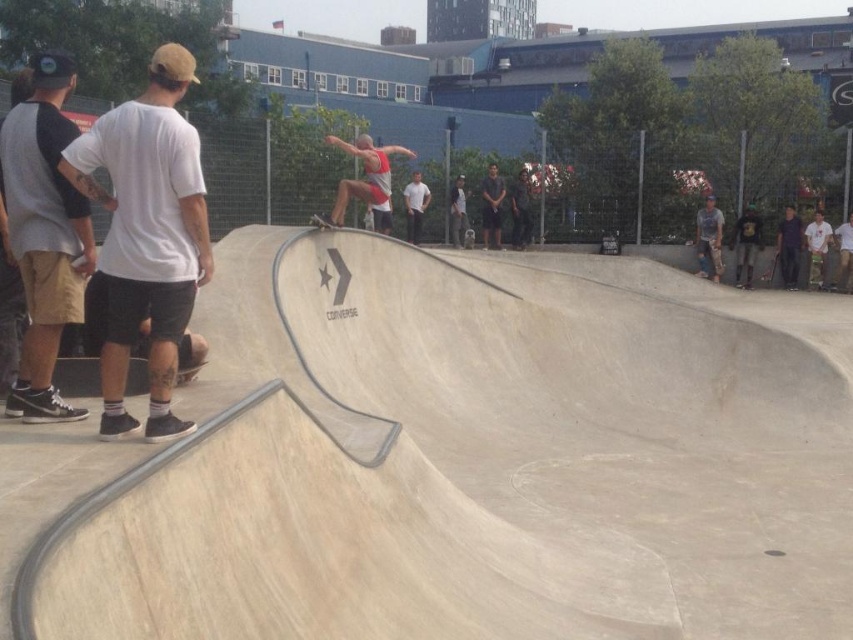
Which of these two, black matte skateboard at lower left or wooden skateboard at lower right, stands shorter?

black matte skateboard at lower left

Which of these two, black matte skateboard at lower left or wooden skateboard at lower right, stands taller?

With more height is wooden skateboard at lower right.

Between point (80, 387) and point (809, 285), which one is positioned behind?

The point (809, 285) is behind.

At what (x,y) coordinates should I click in order to perform the action: click on black matte skateboard at lower left. Please return your answer as a coordinate pair (x, y). The height and width of the screenshot is (640, 853). Looking at the image, I should click on (77, 376).

Which is more to the left, dark gray jeans at right or white matte skateboard at right?

dark gray jeans at right is more to the left.

Is point (734, 262) farther from viewer compared to point (819, 227)?

Yes, point (734, 262) is farther from viewer.

Where is `dark gray jeans at right`? dark gray jeans at right is located at coordinates (746, 244).

Where is `dark gray jeans at right`? dark gray jeans at right is located at coordinates (746, 244).

The image size is (853, 640). What do you see at coordinates (459, 216) in the screenshot?
I see `light brown leather jacket at center` at bounding box center [459, 216].

Does light brown leather jacket at center appear over smooth black skateboard at right?

Correct, light brown leather jacket at center is located above smooth black skateboard at right.

The width and height of the screenshot is (853, 640). Identify the location of light brown leather jacket at center. (459, 216).